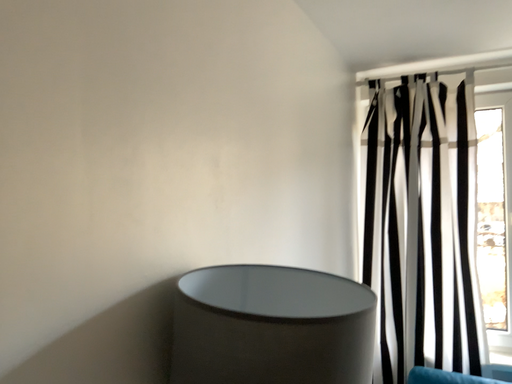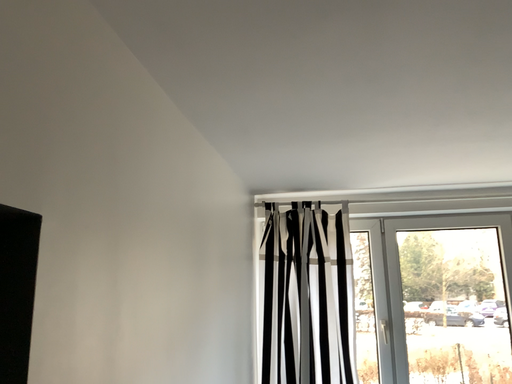
Question: Which way did the camera rotate in the video?

Choices:
 (A) rotated downward
 (B) rotated upward

Answer: (B)